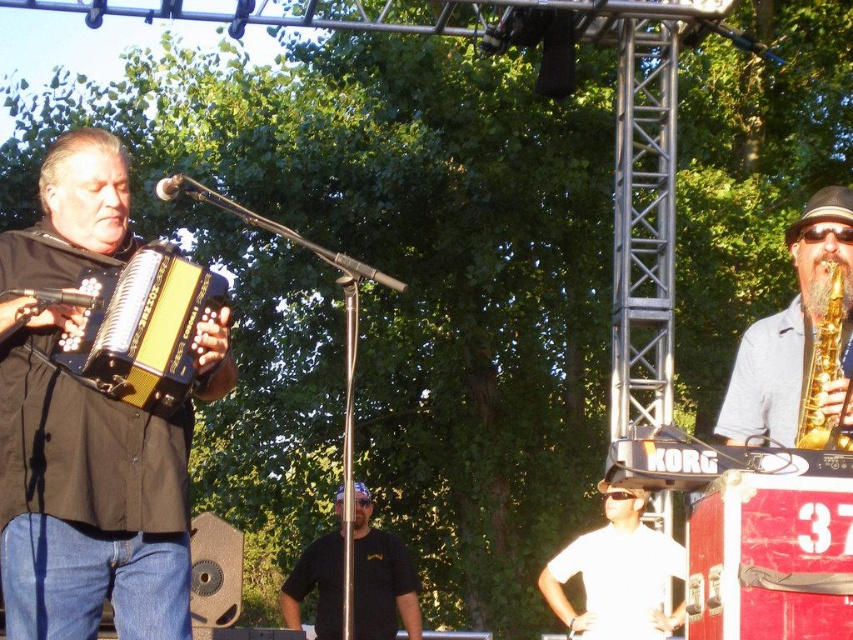
Question: Which is farther from the black t-shirt at center?

Choices:
 (A) black matte accordion at left
 (B) white matte shirt at center
 (C) gold shiny saxophone at upper right

Answer: (C)

Question: Does black matte accordion at left have a smaller size compared to gold metallic saxophone at right?

Choices:
 (A) no
 (B) yes

Answer: (A)

Question: Is matte yellow accordion at left to the right of black t-shirt at center from the viewer's perspective?

Choices:
 (A) yes
 (B) no

Answer: (A)

Question: Which object is positioned closest to the white matte shirt at center?

Choices:
 (A) gold shiny saxophone at upper right
 (B) black matte accordion at left
 (C) black t-shirt at center
 (D) gold metallic saxophone at right

Answer: (C)

Question: Is black matte accordion at left positioned before white matte shirt at center?

Choices:
 (A) no
 (B) yes

Answer: (B)

Question: Which point is closer to the camera?

Choices:
 (A) gold metallic saxophone at right
 (B) gold shiny saxophone at upper right

Answer: (B)